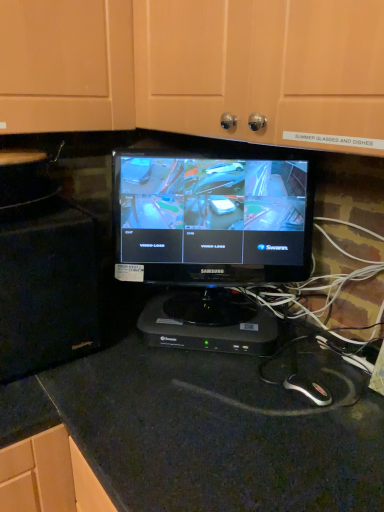
Question: Does black plastic device at center have a greater height compared to black granite countertop at center?

Choices:
 (A) yes
 (B) no

Answer: (B)

Question: Does black plastic device at center come in front of black granite countertop at center?

Choices:
 (A) yes
 (B) no

Answer: (B)

Question: Can you confirm if black plastic device at center is smaller than black granite countertop at center?

Choices:
 (A) no
 (B) yes

Answer: (B)

Question: Could black granite countertop at center be considered to be inside black plastic device at center?

Choices:
 (A) no
 (B) yes

Answer: (A)

Question: Does black plastic device at center appear on the left side of black granite countertop at center?

Choices:
 (A) no
 (B) yes

Answer: (B)

Question: Can you confirm if black plastic device at center is wider than black granite countertop at center?

Choices:
 (A) no
 (B) yes

Answer: (A)

Question: Is matte black monitor at center outside of black plastic device at center?

Choices:
 (A) yes
 (B) no

Answer: (A)

Question: Considering the relative sizes of matte black monitor at center and black plastic device at center in the image provided, is matte black monitor at center taller than black plastic device at center?

Choices:
 (A) yes
 (B) no

Answer: (A)

Question: Is matte black monitor at center with black plastic device at center?

Choices:
 (A) no
 (B) yes

Answer: (A)

Question: From a real-world perspective, does matte black monitor at center stand above black plastic device at center?

Choices:
 (A) no
 (B) yes

Answer: (B)

Question: From a real-world perspective, does matte black monitor at center sit lower than black plastic device at center?

Choices:
 (A) no
 (B) yes

Answer: (A)

Question: Is matte black monitor at center turned away from black plastic device at center?

Choices:
 (A) yes
 (B) no

Answer: (B)

Question: Does matte black monitor at center have a lesser height compared to black granite countertop at center?

Choices:
 (A) no
 (B) yes

Answer: (B)